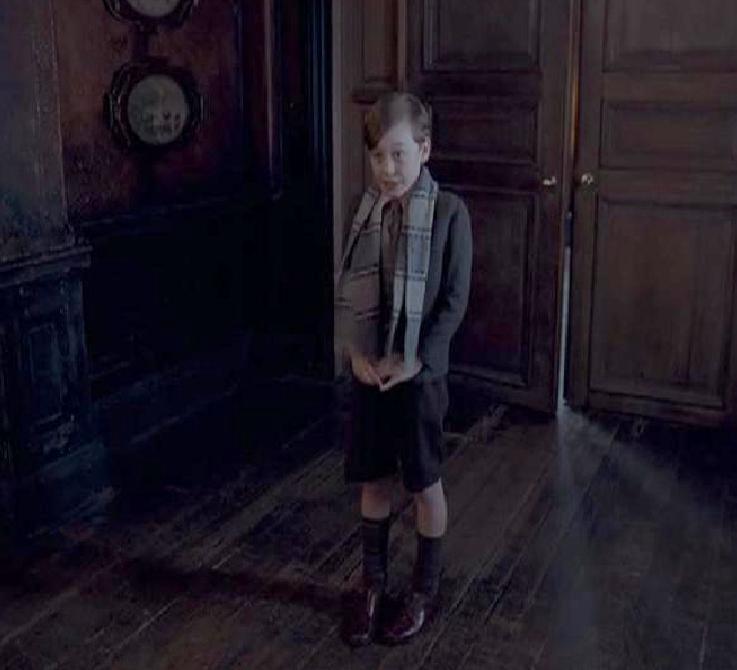
Find the location of `door knobs`. door knobs is located at coordinates (548, 178), (584, 179).